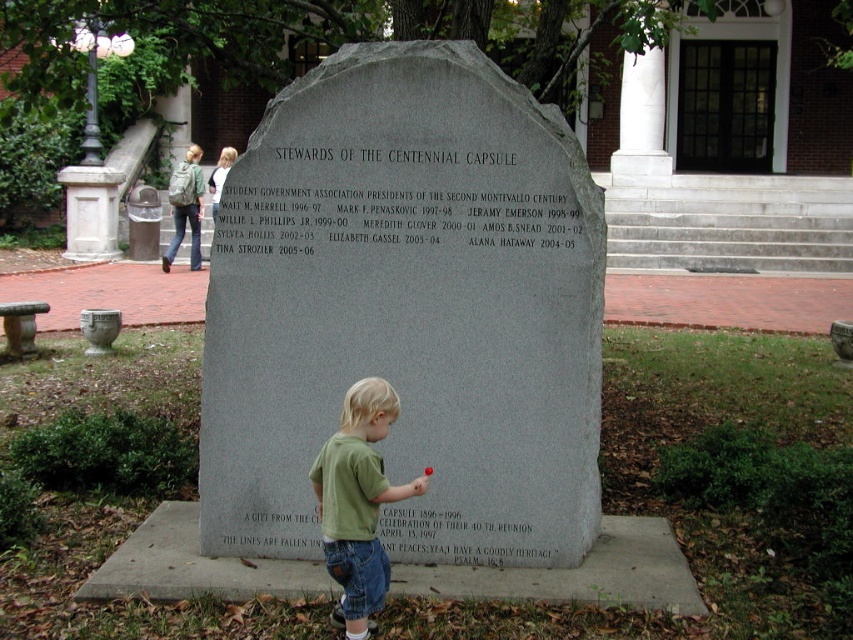
You are a GUI agent. You are given a task and a screenshot of the screen. Output one action in this format:
    pyautogui.click(x=<x>, y=<y>)
    Task: Click on the gray stone plaque at center
    
    Given the screenshot: What is the action you would take?
    pyautogui.click(x=389, y=202)

Who is lower down, gray stone plaque at center or matte gray stone at lower center?

matte gray stone at lower center

Is point (422, 188) farther from viewer compared to point (548, 524)?

No, it is not.

Locate an element on the screen. The height and width of the screenshot is (640, 853). gray stone plaque at center is located at coordinates (389, 202).

Who is lower down, gray stone plaque at center or green cotton shirt at center?

green cotton shirt at center is lower down.

Can you confirm if gray stone plaque at center is positioned to the left of green cotton shirt at center?

No, gray stone plaque at center is not to the left of green cotton shirt at center.

Describe the element at coordinates (389, 202) in the screenshot. This screenshot has width=853, height=640. I see `gray stone plaque at center` at that location.

What are the coordinates of `gray stone plaque at center` in the screenshot? It's located at (389, 202).

This screenshot has width=853, height=640. Describe the element at coordinates (407, 310) in the screenshot. I see `gray stone monument at center` at that location.

How much distance is there between gray stone monument at center and green cotton shirt at center?

gray stone monument at center is 22.78 inches away from green cotton shirt at center.

The height and width of the screenshot is (640, 853). What do you see at coordinates (407, 310) in the screenshot? I see `gray stone monument at center` at bounding box center [407, 310].

Find the location of a particular element. This screenshot has height=640, width=853. gray stone monument at center is located at coordinates (407, 310).